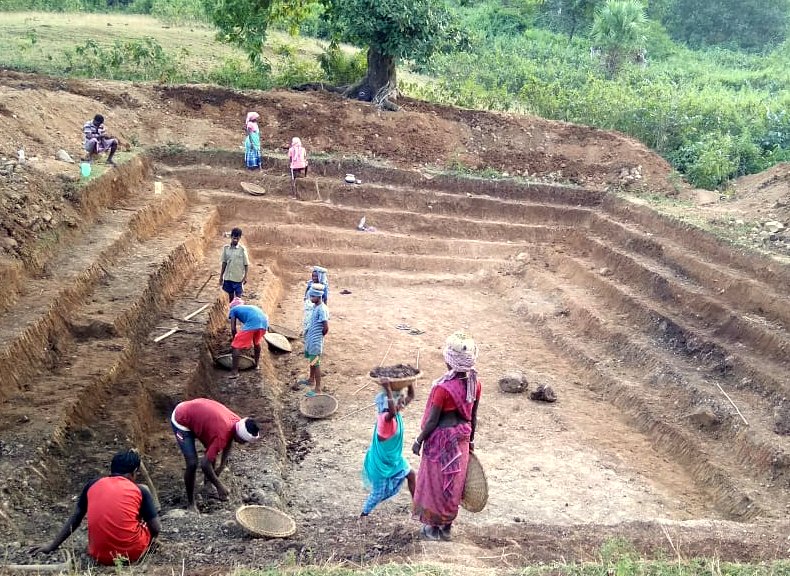
You are a GUI agent. You are given a task and a screenshot of the screen. Output one action in this format:
    pyautogui.click(x=<x>, y=<y>)
    Task: Click on the bowls
    
    Given the screenshot: What is the action you would take?
    pyautogui.click(x=258, y=511), pyautogui.click(x=310, y=406), pyautogui.click(x=401, y=376), pyautogui.click(x=468, y=473), pyautogui.click(x=251, y=189), pyautogui.click(x=53, y=564)